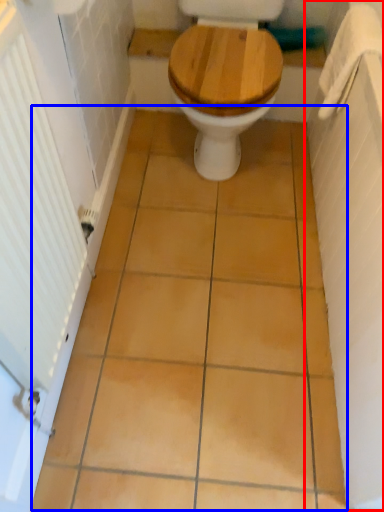
Question: Which object appears farthest to the camera in this image, bath (highlighted by a red box) or ceramic tile (highlighted by a blue box)?

Choices:
 (A) bath
 (B) ceramic tile

Answer: (B)